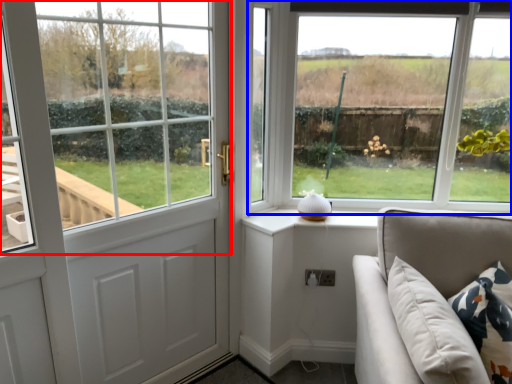
Question: Which of the following is the farthest to the observer, window (highlighted by a red box) or window (highlighted by a blue box)?

Choices:
 (A) window
 (B) window

Answer: (B)